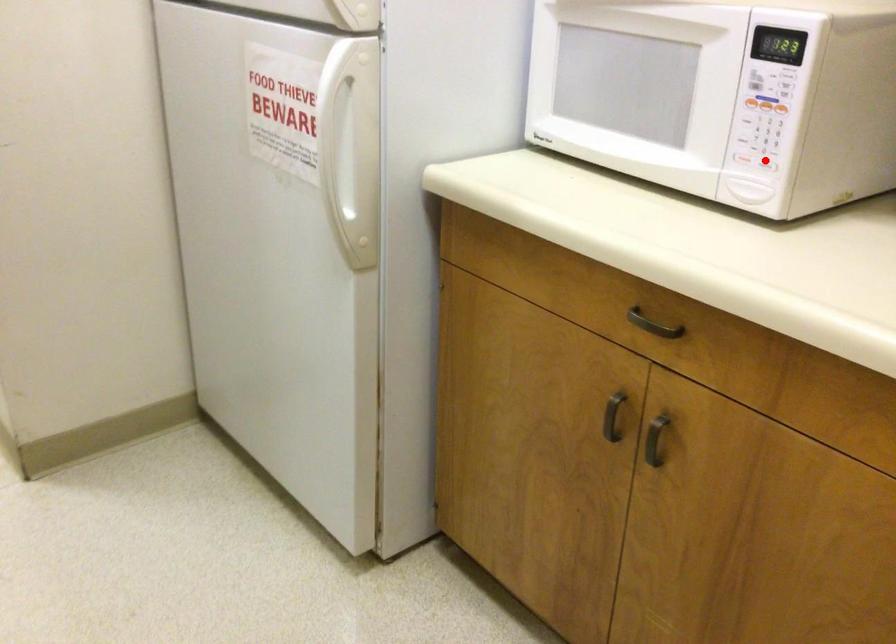
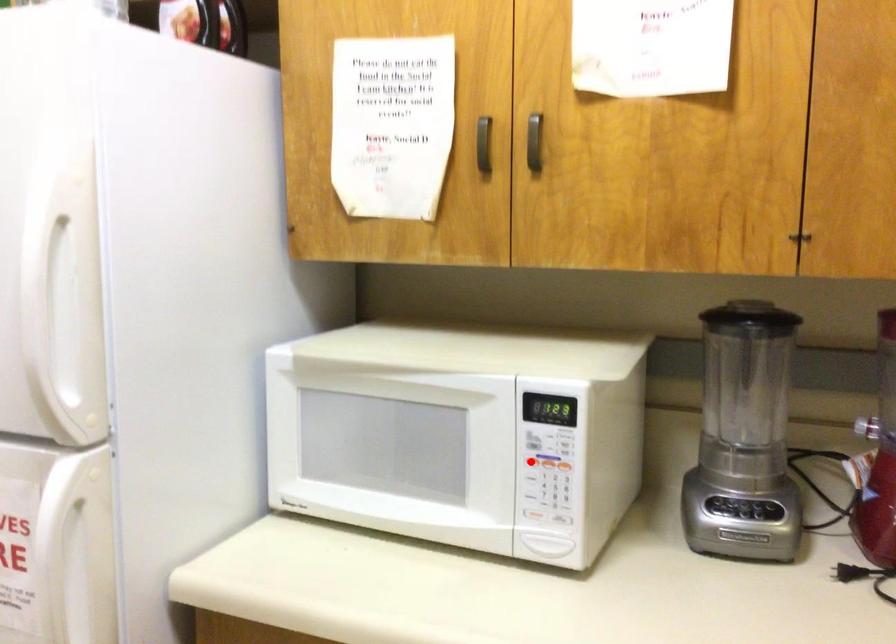
I am providing you with two images of the same scene from different viewpoints. A red point is marked on the first image and another point is marked on the second image. Is the marked point in image1 the same physical position as the marked point in image2?

No